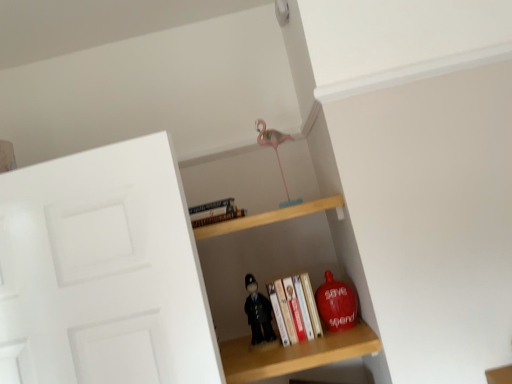
Find the location of a particular element. The height and width of the screenshot is (384, 512). wooden shelf at center, acting as the 1th shelf starting from the bottom is located at coordinates (265, 263).

The height and width of the screenshot is (384, 512). Describe the element at coordinates (275, 152) in the screenshot. I see `pink plastic flamingo at upper center, placed as the 1th toy when sorted from top to bottom` at that location.

What do you see at coordinates (270, 217) in the screenshot? I see `wooden shelf at upper center, which is the 1th shelf in top-to-bottom order` at bounding box center [270, 217].

At what (x,y) coordinates should I click in order to perform the action: click on hardcover book at center, positioned as the second book in top-to-bottom order. Please return your answer as a coordinate pair (x, y). Image resolution: width=512 pixels, height=384 pixels. Looking at the image, I should click on (298, 307).

Measure the distance between point (x=321, y=334) and camera.

Point (x=321, y=334) and camera are 4.37 feet apart.

Locate an element on the screen. This screenshot has width=512, height=384. matte red piggy bank at lower right, marked as the second toy in a bottom-to-top arrangement is located at coordinates (336, 304).

This screenshot has height=384, width=512. In order to click on hardcover book at upper center, the second book viewed from the right in this screenshot , I will do `click(215, 212)`.

Can you tell me how much matte red piggy bank at lower right, marked as the second toy in a bottom-to-top arrangement, and pink plastic flamingo at upper center, placed as the second toy when sorted from right to left, differ in facing direction?

0.00284 degrees separate the facing orientations of matte red piggy bank at lower right, marked as the second toy in a bottom-to-top arrangement, and pink plastic flamingo at upper center, placed as the second toy when sorted from right to left.

From the image's perspective, does matte red piggy bank at lower right, positioned as the 2th toy in top-to-bottom order, appear lower than pink plastic flamingo at upper center, placed as the 1th toy when sorted from top to bottom?

Indeed, from the image's perspective, matte red piggy bank at lower right, positioned as the 2th toy in top-to-bottom order, is shown beneath pink plastic flamingo at upper center, placed as the 1th toy when sorted from top to bottom.

Which object is further away from the camera, matte red piggy bank at lower right, positioned as the 2th toy in top-to-bottom order, or pink plastic flamingo at upper center, placed as the second toy when sorted from right to left?

pink plastic flamingo at upper center, placed as the second toy when sorted from right to left, is further away from the camera.

The height and width of the screenshot is (384, 512). I want to click on toy that is the 1st one when counting downward from the pink plastic flamingo at upper center, marked as the third toy in a bottom-to-top arrangement (from the image's perspective), so click(x=336, y=304).

Which object is wider, wooden shelf at upper center, which is the 1th shelf in top-to-bottom order, or matte red piggy bank at lower right, placed as the third toy when sorted from left to right?

wooden shelf at upper center, which is the 1th shelf in top-to-bottom order.

Is wooden shelf at upper center, placed as the 2th shelf when sorted from bottom to top, oriented away from matte red piggy bank at lower right, placed as the third toy when sorted from left to right?

No, wooden shelf at upper center, placed as the 2th shelf when sorted from bottom to top, is not facing away from matte red piggy bank at lower right, placed as the third toy when sorted from left to right.

From a real-world perspective, which is physically above, wooden shelf at upper center, which is the 1th shelf in top-to-bottom order, or matte red piggy bank at lower right, placed as the third toy when sorted from left to right?

From a 3D spatial view, wooden shelf at upper center, which is the 1th shelf in top-to-bottom order, is above.

Is wooden shelf at center, acting as the 1th shelf starting from the bottom, to the left or to the right of hardcover book at upper center, the second book viewed from the right, in the image?

From the image, it's evident that wooden shelf at center, acting as the 1th shelf starting from the bottom, is to the right of hardcover book at upper center, the second book viewed from the right.

Considering the positions of objects wooden shelf at center, which is the 2th shelf from top to bottom, and hardcover book at upper center, placed as the first book when sorted from left to right, in the image provided, who is in front, wooden shelf at center, which is the 2th shelf from top to bottom, or hardcover book at upper center, placed as the first book when sorted from left to right,?

wooden shelf at center, which is the 2th shelf from top to bottom, is closer to the camera.

In terms of height, does wooden shelf at center, which is the 2th shelf from top to bottom, look taller or shorter compared to hardcover book at upper center, the second book viewed from the right?

wooden shelf at center, which is the 2th shelf from top to bottom, is taller than hardcover book at upper center, the second book viewed from the right.

Between wooden shelf at center, acting as the 1th shelf starting from the bottom, and matte red piggy bank at lower right, placed as the third toy when sorted from left to right, which one has larger width?

With larger width is wooden shelf at center, acting as the 1th shelf starting from the bottom.

Visually, is wooden shelf at center, which is the 2th shelf from top to bottom, positioned to the left or to the right of matte red piggy bank at lower right, marked as the second toy in a bottom-to-top arrangement?

In the image, wooden shelf at center, which is the 2th shelf from top to bottom, appears on the left side of matte red piggy bank at lower right, marked as the second toy in a bottom-to-top arrangement.

Is wooden shelf at center, which is the 2th shelf from top to bottom, positioned with its back to matte red piggy bank at lower right, marked as the second toy in a bottom-to-top arrangement?

wooden shelf at center, which is the 2th shelf from top to bottom, does not have its back to matte red piggy bank at lower right, marked as the second toy in a bottom-to-top arrangement.

This screenshot has height=384, width=512. In order to click on shelf below the matte red piggy bank at lower right, the 1th toy in the right-to-left sequence (from a real-world perspective) in this screenshot , I will do `click(265, 263)`.

Is black matte toy at center, which is counted as the 1th toy, starting from the left, placed right next to hardcover book at upper center, marked as the 1th book in a top-to-bottom arrangement?

No, black matte toy at center, which is counted as the 1th toy, starting from the left, is not touching hardcover book at upper center, marked as the 1th book in a top-to-bottom arrangement.

How many degrees apart are the facing directions of black matte toy at center, which is counted as the 1th toy, starting from the left, and hardcover book at upper center, the 2th book when ordered from bottom to top?

The angle between the facing direction of black matte toy at center, which is counted as the 1th toy, starting from the left, and the facing direction of hardcover book at upper center, the 2th book when ordered from bottom to top, is 0.00171 degrees.

Does black matte toy at center, which is counted as the first toy, starting from the bottom, lie in front of hardcover book at upper center, the 2th book when ordered from bottom to top?

No, it is not.

Locate an element on the screen. This screenshot has height=384, width=512. book above the black matte toy at center, placed as the third toy when sorted from right to left (from a real-world perspective) is located at coordinates pos(215,212).

Which of these two, hardcover book at center, placed as the 2th book when sorted from left to right, or black matte toy at center, placed as the third toy when sorted from right to left, is smaller?

With smaller size is black matte toy at center, placed as the third toy when sorted from right to left.

Can you confirm if hardcover book at center, positioned as the second book in top-to-bottom order, is thinner than black matte toy at center, which is counted as the 1th toy, starting from the left?

No.

From the image's perspective, relative to black matte toy at center, which ranks as the third toy in top-to-bottom order, is hardcover book at center, the first book viewed from the right, above or below?

Based on their image positions, hardcover book at center, the first book viewed from the right, is located above black matte toy at center, which ranks as the third toy in top-to-bottom order.

Is hardcover book at center, placed as the first book when sorted from bottom to top, inside the boundaries of black matte toy at center, placed as the third toy when sorted from right to left, or outside?

hardcover book at center, placed as the first book when sorted from bottom to top, is not inside black matte toy at center, placed as the third toy when sorted from right to left, it's outside.

Which is farther from the camera, (350, 299) or (226, 297)?

The point (226, 297) is more distant.

Who is taller, matte red piggy bank at lower right, placed as the third toy when sorted from left to right, or wooden shelf at center, which is the 2th shelf from top to bottom?

With more height is wooden shelf at center, which is the 2th shelf from top to bottom.

Considering the positions of objects matte red piggy bank at lower right, the 1th toy in the right-to-left sequence, and wooden shelf at center, acting as the 1th shelf starting from the bottom, in the image provided, who is more to the left, matte red piggy bank at lower right, the 1th toy in the right-to-left sequence, or wooden shelf at center, acting as the 1th shelf starting from the bottom,?

wooden shelf at center, acting as the 1th shelf starting from the bottom, is more to the left.

Is matte red piggy bank at lower right, the 1th toy in the right-to-left sequence, thinner than wooden shelf at center, acting as the 1th shelf starting from the bottom?

Yes, matte red piggy bank at lower right, the 1th toy in the right-to-left sequence, is thinner than wooden shelf at center, acting as the 1th shelf starting from the bottom.

In the image, there is a matte red piggy bank at lower right, positioned as the 2th toy in top-to-bottom order. Where is `toy above it (from the image's perspective)`? toy above it (from the image's perspective) is located at coordinates (275, 152).

Identify the location of the 1st toy below the wooden shelf at upper center, placed as the 2th shelf when sorted from bottom to top (from the image's perspective). (336, 304).

Looking at the image, which one is located closer to pink plastic flamingo at upper center, which is the 2th toy from left to right, hardcover book at upper center, the second book viewed from the right, or hardcover book at center, positioned as the second book in top-to-bottom order?

hardcover book at upper center, the second book viewed from the right, is positioned closer to the anchor pink plastic flamingo at upper center, which is the 2th toy from left to right.

Estimate the real-world distances between objects in this image. Which object is closer to pink plastic flamingo at upper center, which is the 2th toy from left to right, matte red piggy bank at lower right, positioned as the 2th toy in top-to-bottom order, or hardcover book at upper center, the second book viewed from the right?

hardcover book at upper center, the second book viewed from the right.

Considering their positions, is wooden shelf at center, acting as the 1th shelf starting from the bottom, positioned further to hardcover book at upper center, the second book viewed from the right, than black matte toy at center, placed as the third toy when sorted from right to left?

black matte toy at center, placed as the third toy when sorted from right to left.

From the image, which object appears to be nearer to matte red piggy bank at lower right, placed as the third toy when sorted from left to right, wooden shelf at center, which is the 2th shelf from top to bottom, or black matte toy at center, placed as the third toy when sorted from right to left?

The object closer to matte red piggy bank at lower right, placed as the third toy when sorted from left to right, is black matte toy at center, placed as the third toy when sorted from right to left.

Which object lies further to the anchor point wooden shelf at center, acting as the 1th shelf starting from the bottom, matte red piggy bank at lower right, marked as the second toy in a bottom-to-top arrangement, or black matte toy at center, which is counted as the 1th toy, starting from the left?

Among the two, matte red piggy bank at lower right, marked as the second toy in a bottom-to-top arrangement, is located further to wooden shelf at center, acting as the 1th shelf starting from the bottom.

When comparing their distances from matte red piggy bank at lower right, marked as the second toy in a bottom-to-top arrangement, does wooden shelf at upper center, placed as the 2th shelf when sorted from bottom to top, or black matte toy at center, which is counted as the first toy, starting from the bottom, seem further?

The object further to matte red piggy bank at lower right, marked as the second toy in a bottom-to-top arrangement, is wooden shelf at upper center, placed as the 2th shelf when sorted from bottom to top.

From the image, which object appears to be nearer to hardcover book at center, positioned as the second book in top-to-bottom order, pink plastic flamingo at upper center, marked as the third toy in a bottom-to-top arrangement, or wooden shelf at center, which is the 2th shelf from top to bottom?

Among the two, wooden shelf at center, which is the 2th shelf from top to bottom, is located nearer to hardcover book at center, positioned as the second book in top-to-bottom order.

Based on their spatial positions, is wooden shelf at upper center, placed as the 2th shelf when sorted from bottom to top, or hardcover book at upper center, marked as the 1th book in a top-to-bottom arrangement, closer to matte red piggy bank at lower right, positioned as the 2th toy in top-to-bottom order?

wooden shelf at upper center, placed as the 2th shelf when sorted from bottom to top, lies closer to matte red piggy bank at lower right, positioned as the 2th toy in top-to-bottom order, than the other object.

Locate an element on the screen. This screenshot has height=384, width=512. book between wooden shelf at upper center, which is the 1th shelf in top-to-bottom order, and black matte toy at center, which is counted as the first toy, starting from the bottom, vertically is located at coordinates (298, 307).

This screenshot has width=512, height=384. Find the location of `shelf between hardcover book at upper center, the 2th book when ordered from bottom to top, and black matte toy at center, which is counted as the 1th toy, starting from the left, vertically`. shelf between hardcover book at upper center, the 2th book when ordered from bottom to top, and black matte toy at center, which is counted as the 1th toy, starting from the left, vertically is located at coordinates (270, 217).

Find the location of a particular element. The height and width of the screenshot is (384, 512). toy between pink plastic flamingo at upper center, which is the 2th toy from left to right, and black matte toy at center, placed as the third toy when sorted from right to left, in the vertical direction is located at coordinates (336, 304).

Where is `book between hardcover book at upper center, placed as the first book when sorted from left to right, and black matte toy at center, placed as the third toy when sorted from right to left, vertically`? book between hardcover book at upper center, placed as the first book when sorted from left to right, and black matte toy at center, placed as the third toy when sorted from right to left, vertically is located at coordinates (298, 307).